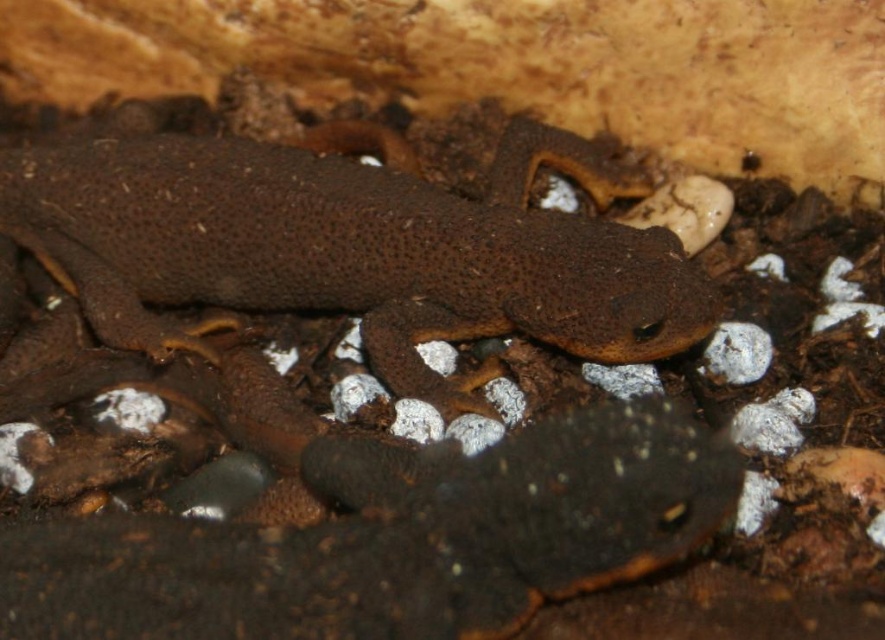
In the scene with a smooth brown lizard at center and a white matte stone at lower right, which object is positioned to the left of the other?

The smooth brown lizard at center is to the left of white matte stone at lower right.

You are a herpetologist observing two animals in a terrarium. You see the brown rough skin lizard at center and the white matte stone at lower right. Which object is taller?

The brown rough skin lizard at center is much taller than the white matte stone at lower right.

Consider the image. You are a photographer aiming to capture a closeup of the brown rough skin lizard at center. Based on the scene description, what is the minimum distance you need to position your camera from the lizard to get a clear shot?

The brown rough skin lizard at center is 3.87 feet away from the camera, so the minimum distance needed to position the camera for a clear shot is 3.87 feet.